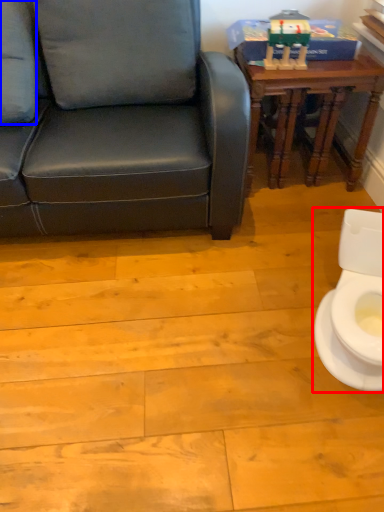
Question: Among these objects, which one is nearest to the camera, toilet (highlighted by a red box) or pillow (highlighted by a blue box)?

Choices:
 (A) toilet
 (B) pillow

Answer: (A)